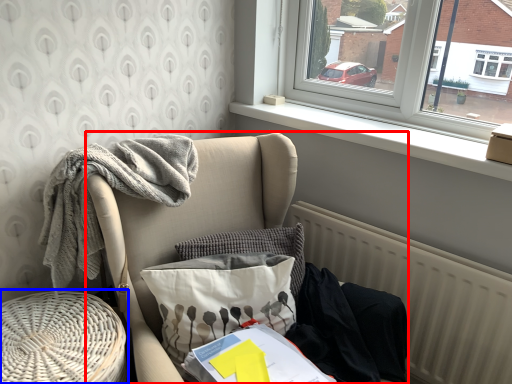
Question: Which object appears closest to the camera in this image, furniture (highlighted by a red box) or side table (highlighted by a blue box)?

Choices:
 (A) furniture
 (B) side table

Answer: (A)